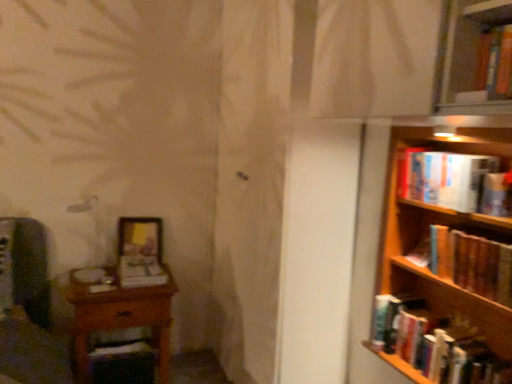
Measure the distance between point (121, 269) and camera.

The distance of point (121, 269) from camera is 2.49 meters.

At what (x,y) coordinates should I click in order to perform the action: click on matte white book at center, which appears as the second book when ordered from the bottom. Please return your answer as a coordinate pair (x, y). The width and height of the screenshot is (512, 384). Looking at the image, I should click on (141, 272).

You are a GUI agent. You are given a task and a screenshot of the screen. Output one action in this format:
    pyautogui.click(x=<x>, y=<y>)
    Task: Click on the hardcover book at right, which ranks as the fourth book in left-to-right order
    This screenshot has height=384, width=512.
    Given the screenshot: What is the action you would take?
    pyautogui.click(x=472, y=263)

This screenshot has height=384, width=512. What do you see at coordinates (447, 248) in the screenshot? I see `wooden bookshelf at right` at bounding box center [447, 248].

I want to click on hardcover book at right, the 1th book from the bottom, so click(x=433, y=344).

You are a GUI agent. You are given a task and a screenshot of the screen. Output one action in this format:
    pyautogui.click(x=<x>, y=<y>)
    Task: Click on the hardcover book at upper right, marked as the 4th book in a bottom-to-top arrangement
    The height and width of the screenshot is (384, 512).
    Given the screenshot: What is the action you would take?
    pyautogui.click(x=444, y=178)

Is wooden table at left spatially inside hardcover book at right, which is the 4th book from top to bottom, or outside of it?

wooden table at left lies outside hardcover book at right, which is the 4th book from top to bottom.

Considering the relative sizes of wooden table at left and hardcover book at right, which is the 4th book from top to bottom, in the image provided, is wooden table at left thinner than hardcover book at right, which is the 4th book from top to bottom,?

Incorrect, the width of wooden table at left is not less than that of hardcover book at right, which is the 4th book from top to bottom.

Does point (108, 329) come closer to viewer compared to point (412, 373)?

No, (108, 329) is further to viewer.

Is wooden table at left aimed at hardcover book at right, which is the 4th book from top to bottom?

No, wooden table at left is not oriented towards hardcover book at right, which is the 4th book from top to bottom.

Is wooden frame at lower left completely or partially inside wooden bookshelf at right?

That's incorrect, wooden frame at lower left is not inside wooden bookshelf at right.

Would you consider wooden bookshelf at right to be distant from wooden frame at lower left?

Indeed, wooden bookshelf at right is not near wooden frame at lower left.

Considering the positions of objects wooden bookshelf at right and wooden frame at lower left in the image provided, who is behind, wooden bookshelf at right or wooden frame at lower left?

wooden frame at lower left is further away from the camera.

Considering the relative positions of hardcover book at right, the 3th book when ordered from bottom to top, and hardcover book at upper right, placed as the 2th book when sorted from left to right, in the image provided, is hardcover book at right, the 3th book when ordered from bottom to top, to the left or to the right of hardcover book at upper right, placed as the 2th book when sorted from left to right,?

hardcover book at right, the 3th book when ordered from bottom to top, is to the right of hardcover book at upper right, placed as the 2th book when sorted from left to right.

Is hardcover book at right, placed as the 1th book when sorted from right to left, positioned with its back to hardcover book at upper right, the 3th book from the right?

No, hardcover book at right, placed as the 1th book when sorted from right to left,'s orientation is not away from hardcover book at upper right, the 3th book from the right.

Looking at the image, does hardcover book at right, which is the second book in top-to-bottom order, seem bigger or smaller compared to hardcover book at upper right, the 3th book from the right?

Clearly, hardcover book at right, which is the second book in top-to-bottom order, is larger in size than hardcover book at upper right, the 3th book from the right.

Are hardcover book at right, the 3th book when ordered from bottom to top, and hardcover book at upper right, placed as the 2th book when sorted from left to right, making contact?

hardcover book at right, the 3th book when ordered from bottom to top, and hardcover book at upper right, placed as the 2th book when sorted from left to right, are clearly separated.

Is wooden bookshelf at right inside the boundaries of matte white book at center, the 3th book from the top, or outside?

wooden bookshelf at right exists outside the volume of matte white book at center, the 3th book from the top.

The height and width of the screenshot is (384, 512). In order to click on bookcase above the matte white book at center, which is the first book in left-to-right order (from a real-world perspective) in this screenshot , I will do `click(447, 248)`.

Does wooden bookshelf at right turn towards matte white book at center, the 3th book from the top?

No, wooden bookshelf at right is not turned towards matte white book at center, the 3th book from the top.

Is wooden frame at lower left looking in the opposite direction of wooden bookshelf at right?

No, wooden frame at lower left is not facing away from wooden bookshelf at right.

Considering their positions, is wooden frame at lower left located in front of or behind wooden bookshelf at right?

Visually, wooden frame at lower left is located behind wooden bookshelf at right.

Is wooden frame at lower left not near wooden bookshelf at right?

Yes, wooden frame at lower left and wooden bookshelf at right are quite far apart.

Which book is the 3rd one when counting from the front of the matte white book at center, which appears as the second book when ordered from the bottom? Please provide its 2D coordinates.

[(472, 263)]

Can we say hardcover book at right, placed as the 1th book when sorted from right to left, lies outside matte white book at center, which is the first book in left-to-right order?

Yes, hardcover book at right, placed as the 1th book when sorted from right to left, is located beyond the bounds of matte white book at center, which is the first book in left-to-right order.

In the scene shown: Could you tell me if hardcover book at right, the 3th book when ordered from bottom to top, is turned towards matte white book at center, which is the 4th book from right to left?

No, hardcover book at right, the 3th book when ordered from bottom to top, is not facing towards matte white book at center, which is the 4th book from right to left.

From the image's perspective, is hardcover book at right, which is the second book in top-to-bottom order, located beneath matte white book at center, which is the first book in left-to-right order?

No, from the image's perspective, hardcover book at right, which is the second book in top-to-bottom order, is not below matte white book at center, which is the first book in left-to-right order.

Is point (406, 324) positioned before point (498, 348)?

No, it is not.

From a real-world perspective, does hardcover book at right, placed as the 2th book when sorted from right to left, sit lower than wooden bookshelf at right?

Yes, from a real-world perspective, hardcover book at right, placed as the 2th book when sorted from right to left, is below wooden bookshelf at right.

From their relative heights in the image, would you say hardcover book at right, placed as the 3th book when sorted from left to right, is taller or shorter than wooden bookshelf at right?

In the image, hardcover book at right, placed as the 3th book when sorted from left to right, appears to be shorter than wooden bookshelf at right.

Which object is wider, hardcover book at right, placed as the 3th book when sorted from left to right, or wooden bookshelf at right?

Wider between the two is wooden bookshelf at right.

Locate an element on the screen. The height and width of the screenshot is (384, 512). table below the hardcover book at right, the 1th book from the bottom (from a real-world perspective) is located at coordinates (118, 315).

Find the location of a particular element. bookcase on the right of wooden frame at lower left is located at coordinates (447, 248).

When comparing their distances from matte white book at center, which is the first book in left-to-right order, does hardcover book at upper right, the 3th book from the right, or wooden table at left seem closer?

Among the two, wooden table at left is located nearer to matte white book at center, which is the first book in left-to-right order.

Considering their positions, is matte white book at center, which is the first book in left-to-right order, positioned closer to hardcover book at right, the 3th book when ordered from bottom to top, than wooden frame at lower left?

Among the two, matte white book at center, which is the first book in left-to-right order, is located nearer to hardcover book at right, the 3th book when ordered from bottom to top.

Estimate the real-world distances between objects in this image. Which object is further from hardcover book at right, which ranks as the fourth book in left-to-right order, wooden table at left or wooden bookshelf at right?

wooden table at left.

Based on their spatial positions, is matte white book at center, which is the 4th book from right to left, or wooden table at left closer to wooden frame at lower left?

Based on the image, matte white book at center, which is the 4th book from right to left, appears to be nearer to wooden frame at lower left.

Estimate the real-world distances between objects in this image. Which object is further from matte white book at center, which is the first book in left-to-right order, hardcover book at right, placed as the 1th book when sorted from right to left, or hardcover book at right, placed as the 2th book when sorted from right to left?

hardcover book at right, placed as the 1th book when sorted from right to left, lies further to matte white book at center, which is the first book in left-to-right order, than the other object.

When comparing their distances from hardcover book at right, which is the second book in top-to-bottom order, does wooden table at left or matte white book at center, which appears as the second book when ordered from the bottom, seem further?

wooden table at left is positioned further to the anchor hardcover book at right, which is the second book in top-to-bottom order.

From the image, which object appears to be nearer to wooden bookshelf at right, hardcover book at upper right, which ranks as the first book in top-to-bottom order, or matte white book at center, which is the first book in left-to-right order?

Based on the image, hardcover book at upper right, which ranks as the first book in top-to-bottom order, appears to be nearer to wooden bookshelf at right.

From the picture: Based on their spatial positions, is hardcover book at upper right, marked as the 4th book in a bottom-to-top arrangement, or hardcover book at right, the 3th book when ordered from bottom to top, further from hardcover book at right, which is the 4th book from top to bottom?

Among the two, hardcover book at upper right, marked as the 4th book in a bottom-to-top arrangement, is located further to hardcover book at right, which is the 4th book from top to bottom.

At what (x,y) coordinates should I click in order to perform the action: click on book situated between matte white book at center, which appears as the second book when ordered from the bottom, and hardcover book at right, placed as the 2th book when sorted from right to left, from left to right. Please return your answer as a coordinate pair (x, y). The image size is (512, 384). Looking at the image, I should click on (444, 178).

Locate an element on the screen. This screenshot has width=512, height=384. bookcase that lies between hardcover book at upper right, placed as the 2th book when sorted from left to right, and hardcover book at right, placed as the 3th book when sorted from left to right, from top to bottom is located at coordinates (447, 248).

I want to click on picture frame between wooden table at left and hardcover book at upper right, which ranks as the first book in top-to-bottom order, in the horizontal direction, so click(x=140, y=237).

You are a GUI agent. You are given a task and a screenshot of the screen. Output one action in this format:
    pyautogui.click(x=<x>, y=<y>)
    Task: Click on the picture frame between wooden table at left and hardcover book at right, placed as the 1th book when sorted from right to left, in the horizontal direction
    
    Given the screenshot: What is the action you would take?
    pyautogui.click(x=140, y=237)